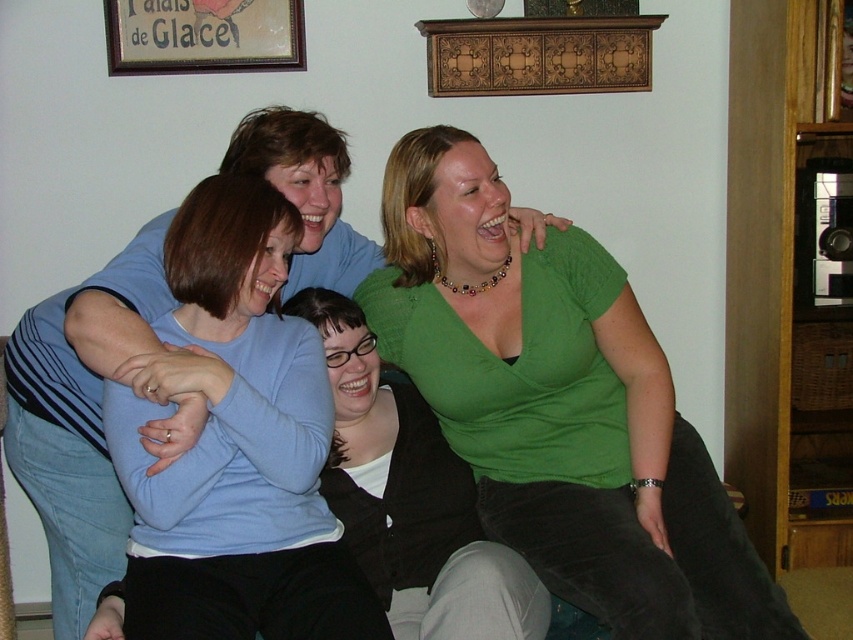
Question: Considering the relative positions of green matte shirt at upper right and wooden frame at upper center in the image provided, where is green matte shirt at upper right located with respect to wooden frame at upper center?

Choices:
 (A) left
 (B) right

Answer: (B)

Question: Is green matte shirt at center behind wooden frame at upper center?

Choices:
 (A) yes
 (B) no

Answer: (B)

Question: Which object is farther from the camera taking this photo?

Choices:
 (A) matte blue sweater at center
 (B) wooden frame at upper center
 (C) green matte shirt at upper right
 (D) green matte shirt at center

Answer: (B)

Question: Does green matte shirt at upper right lie behind wooden frame at upper center?

Choices:
 (A) no
 (B) yes

Answer: (A)

Question: Among these objects, which one is nearest to the camera?

Choices:
 (A) green matte shirt at upper right
 (B) green matte shirt at center
 (C) wooden frame at upper center

Answer: (A)

Question: Which object is the closest to the green matte shirt at upper right?

Choices:
 (A) green matte shirt at center
 (B) matte blue sweater at center

Answer: (A)